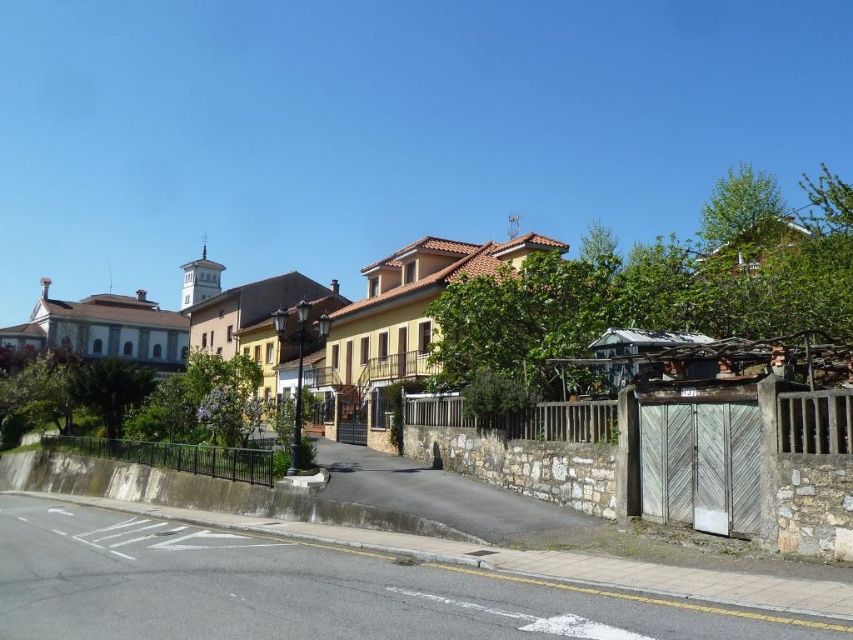
Question: Is wooden fence at center to the left of black metal fence at lower left from the viewer's perspective?

Choices:
 (A) yes
 (B) no

Answer: (B)

Question: Considering the relative positions of wooden fence at center and black metal fence at lower left in the image provided, where is wooden fence at center located with respect to black metal fence at lower left?

Choices:
 (A) below
 (B) above

Answer: (B)

Question: Does wooden fence at center have a greater width compared to black metal fence at lower left?

Choices:
 (A) yes
 (B) no

Answer: (B)

Question: Which of the following is the closest to the observer?

Choices:
 (A) (131, 460)
 (B) (410, 400)

Answer: (B)